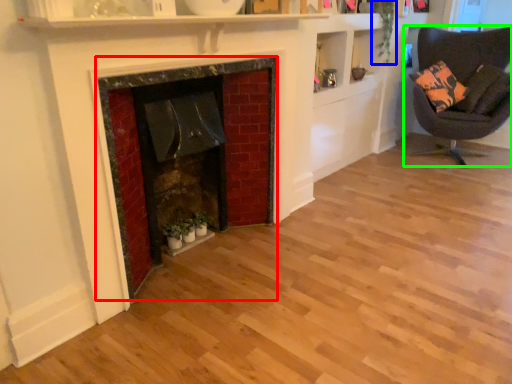
Question: Based on their relative distances, which object is farther from fireplace (highlighted by a red box)? Choose from plant (highlighted by a blue box) and chair (highlighted by a green box).

Choices:
 (A) plant
 (B) chair

Answer: (B)